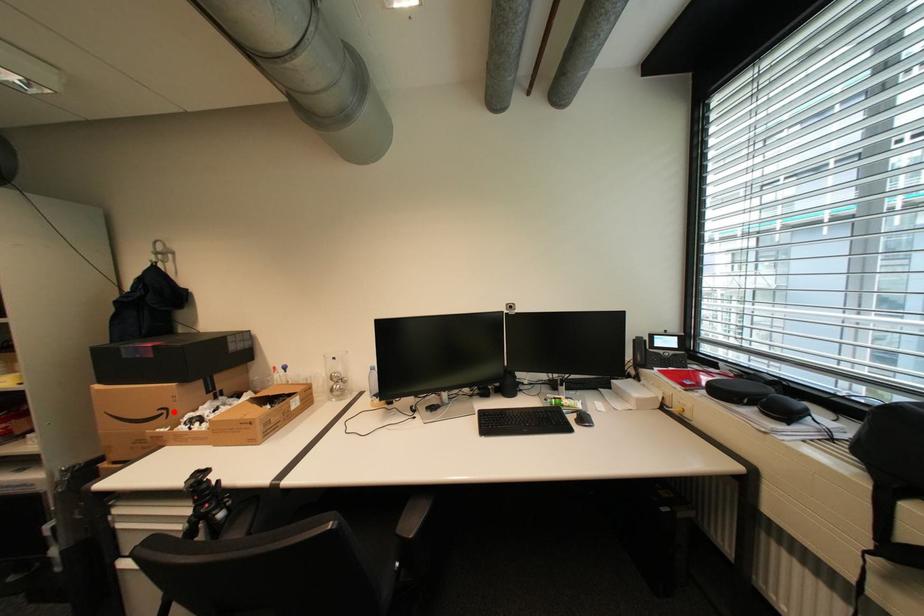
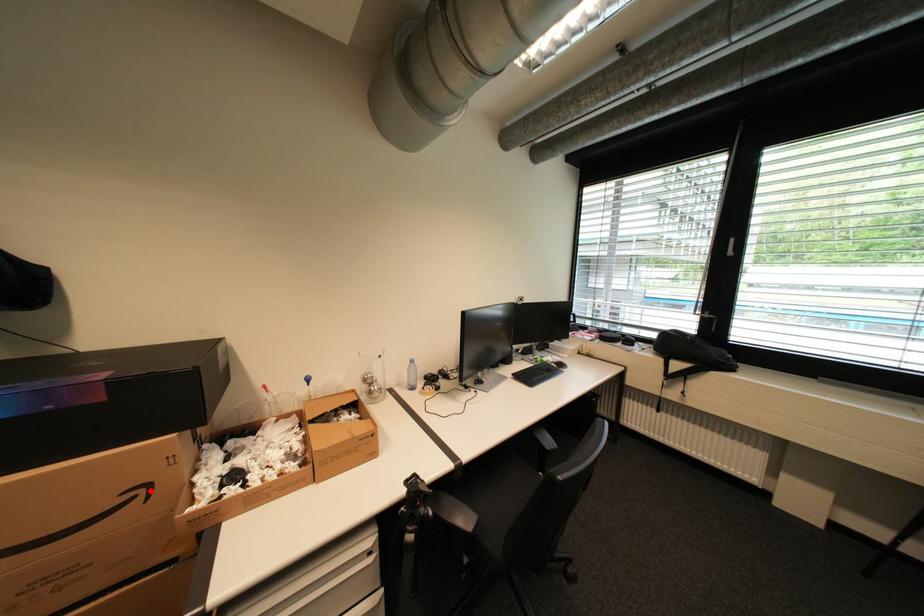
I am providing you with two images of the same scene from different viewpoints. A red point is marked on the first image and another point is marked on the second image. Do the highlighted points in image1 and image2 indicate the same real-world spot?

Yes